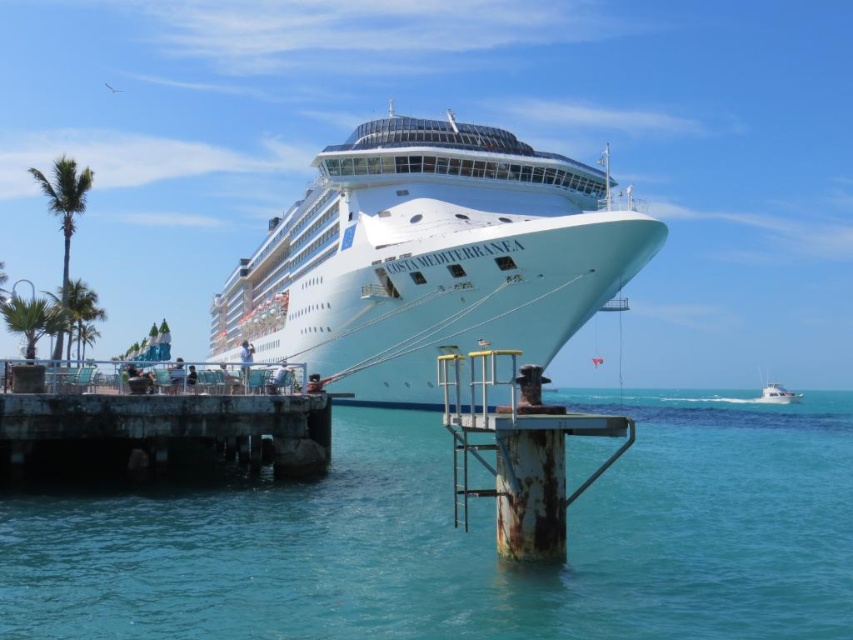
Can you confirm if rusty metal dock at lower left is positioned to the right of white glossy boat at right?

No, rusty metal dock at lower left is not to the right of white glossy boat at right.

Identify the location of rusty metal dock at lower left. This screenshot has height=640, width=853. (157, 429).

Which of these two, white glossy cruise ship at center or rusty metal dock at lower left, stands shorter?

rusty metal dock at lower left

Does white glossy cruise ship at center have a greater height compared to rusty metal dock at lower left?

Yes.

Which is behind, point (370, 132) or point (146, 396)?

The point (370, 132) is behind.

Find the location of a particular element. white glossy cruise ship at center is located at coordinates (428, 259).

Does clear blue water at lower left lie behind white glossy cruise ship at center?

No, it is not.

Does clear blue water at lower left appear on the right side of white glossy cruise ship at center?

Indeed, clear blue water at lower left is positioned on the right side of white glossy cruise ship at center.

Is point (521, 572) in front of point (287, 340)?

Yes.

Where is `clear blue water at lower left`? This screenshot has width=853, height=640. clear blue water at lower left is located at coordinates (465, 540).